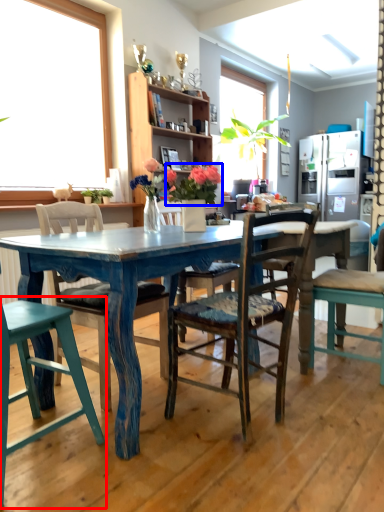
Question: Which of the following is the farthest to the observer, chair (highlighted by a red box) or floral arrangement (highlighted by a blue box)?

Choices:
 (A) chair
 (B) floral arrangement

Answer: (B)